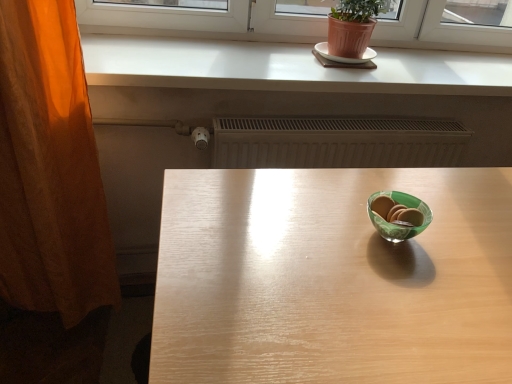
Question: Is white matte counter top at upper center located outside orange fabric curtain at left?

Choices:
 (A) no
 (B) yes

Answer: (B)

Question: From the image's perspective, is white matte counter top at upper center located above orange fabric curtain at left?

Choices:
 (A) no
 (B) yes

Answer: (B)

Question: Can you confirm if white matte counter top at upper center is taller than orange fabric curtain at left?

Choices:
 (A) no
 (B) yes

Answer: (A)

Question: Is white matte counter top at upper center at the right side of orange fabric curtain at left?

Choices:
 (A) yes
 (B) no

Answer: (A)

Question: Is white matte counter top at upper center positioned in front of orange fabric curtain at left?

Choices:
 (A) no
 (B) yes

Answer: (A)

Question: Considering the positions of orange fabric curtain at left and light wood table at center in the image, is orange fabric curtain at left wider or thinner than light wood table at center?

Choices:
 (A) thin
 (B) wide

Answer: (A)

Question: Considering the positions of point (88, 248) and point (454, 382), is point (88, 248) closer or farther from the camera than point (454, 382)?

Choices:
 (A) closer
 (B) farther

Answer: (B)

Question: From a real-world perspective, is orange fabric curtain at left physically located above or below light wood table at center?

Choices:
 (A) above
 (B) below

Answer: (A)

Question: Is orange fabric curtain at left to the left or to the right of light wood table at center in the image?

Choices:
 (A) left
 (B) right

Answer: (A)

Question: Is orange fabric curtain at left inside the boundaries of white ceramic plate at upper center, or outside?

Choices:
 (A) outside
 (B) inside

Answer: (A)

Question: Would you say orange fabric curtain at left is to the left or to the right of white ceramic plate at upper center in the picture?

Choices:
 (A) right
 (B) left

Answer: (B)

Question: Considering the positions of orange fabric curtain at left and white ceramic plate at upper center in the image, is orange fabric curtain at left taller or shorter than white ceramic plate at upper center?

Choices:
 (A) short
 (B) tall

Answer: (B)

Question: From the image's perspective, is orange fabric curtain at left positioned above or below white ceramic plate at upper center?

Choices:
 (A) above
 (B) below

Answer: (B)

Question: Choose the correct answer: Is white ceramic plate at upper center inside orange fabric curtain at left or outside it?

Choices:
 (A) inside
 (B) outside

Answer: (B)

Question: Based on their sizes in the image, would you say white ceramic plate at upper center is bigger or smaller than orange fabric curtain at left?

Choices:
 (A) big
 (B) small

Answer: (B)